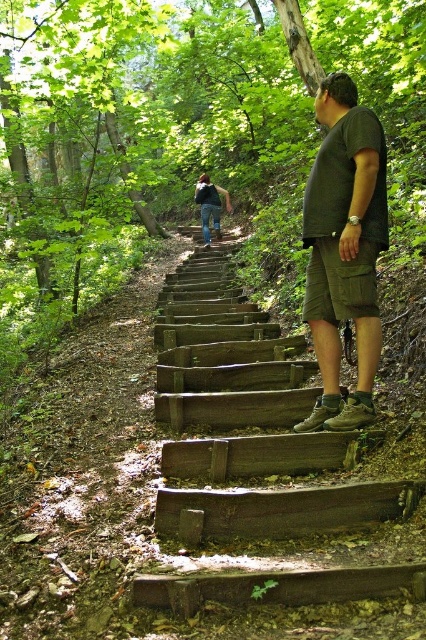
Question: Which of the following is the closest to the observer?

Choices:
 (A) (339, 204)
 (B) (393, 497)
 (C) (229, 204)

Answer: (B)

Question: Can you confirm if dark green t-shirt at center is smaller than blue jeans at upper center?

Choices:
 (A) no
 (B) yes

Answer: (B)

Question: Is weathered wood stairs at center closer to the viewer compared to blue jeans at upper center?

Choices:
 (A) yes
 (B) no

Answer: (A)

Question: Which point appears closest to the camera in this image?

Choices:
 (A) (212, 184)
 (B) (324, 273)
 (C) (235, 323)

Answer: (B)

Question: Estimate the real-world distances between objects in this image. Which object is farther from the blue jeans at upper center?

Choices:
 (A) weathered wood stairs at center
 (B) dark green t-shirt at center

Answer: (B)

Question: Is weathered wood stairs at center wider than dark green t-shirt at center?

Choices:
 (A) yes
 (B) no

Answer: (A)